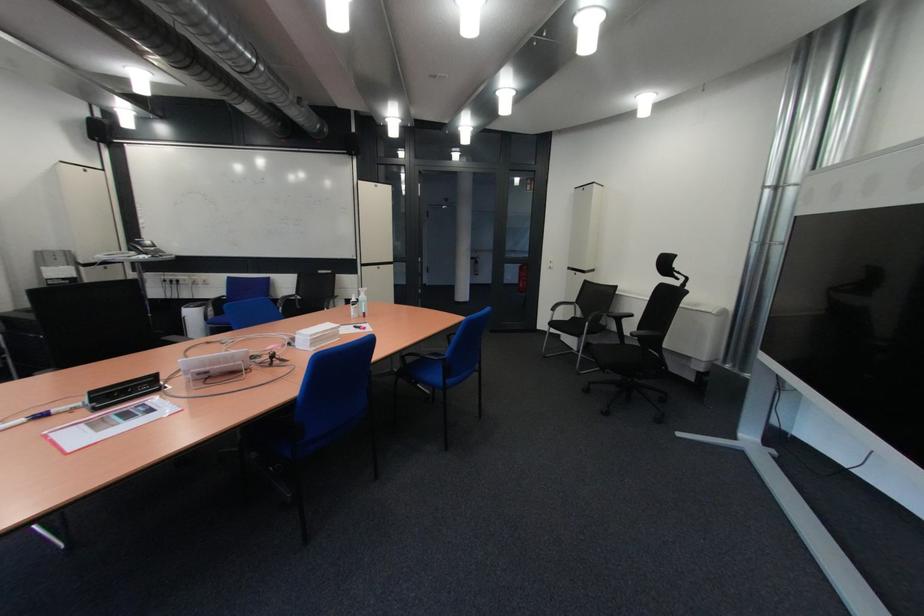
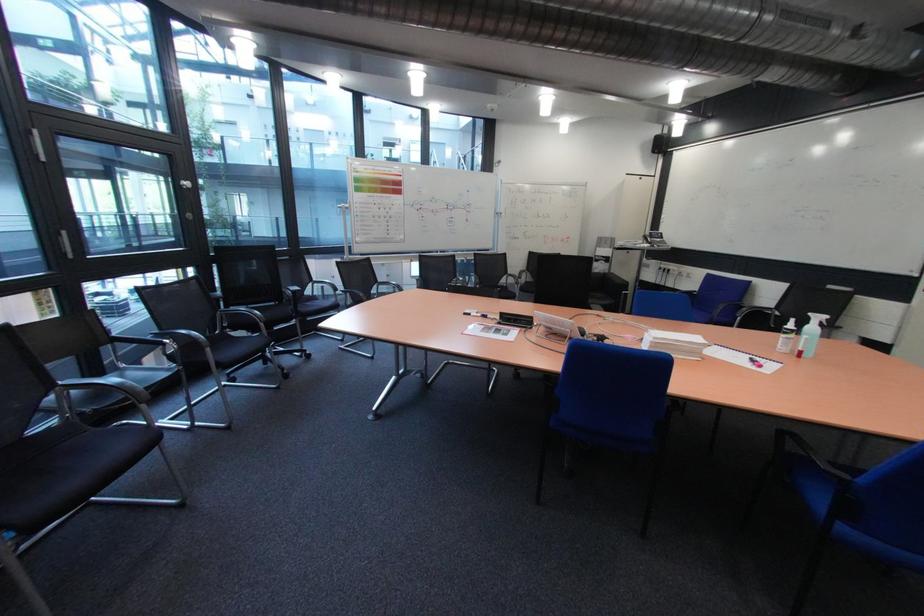
Question: The camera is either moving clockwise (left) or counter-clockwise (right) around the object. The first image is from the beginning of the video and the second image is from the end. Is the camera moving left or right when shooting the video?

Choices:
 (A) Left
 (B) Right

Answer: (B)